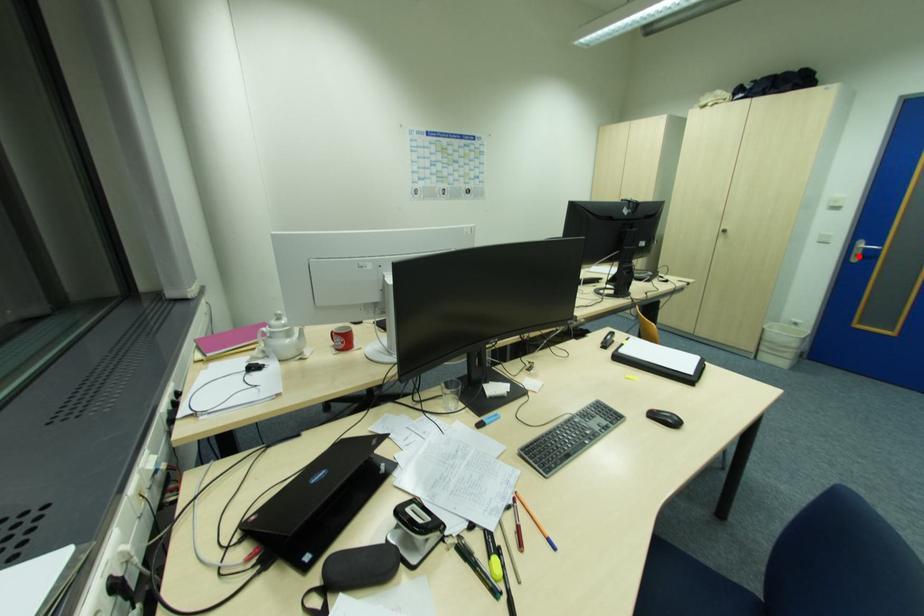
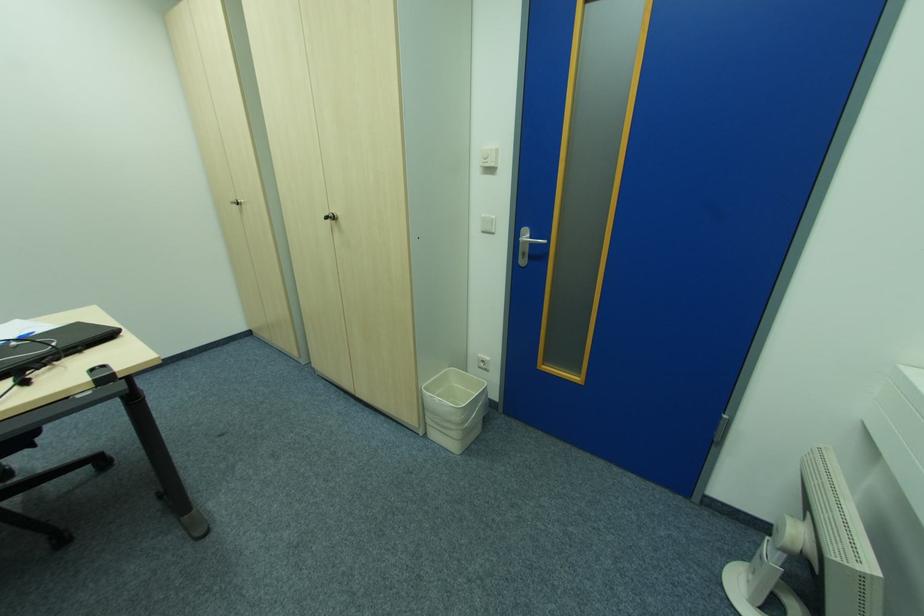
In the second image, find the point that corresponds to the highlighted location in the first image.

(526, 256)